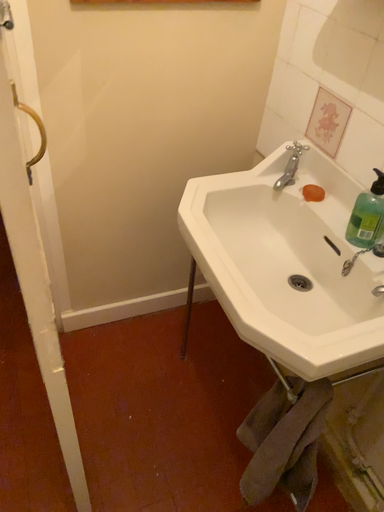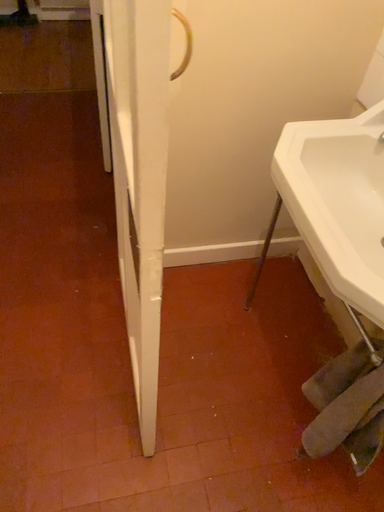
Question: Which way did the camera rotate in the video?

Choices:
 (A) rotated right
 (B) rotated left

Answer: (B)